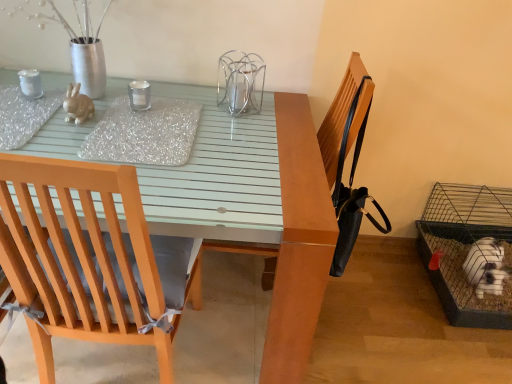
Find the location of `vacant area situated to the left side of clear glass candle at center`. vacant area situated to the left side of clear glass candle at center is located at coordinates (103, 107).